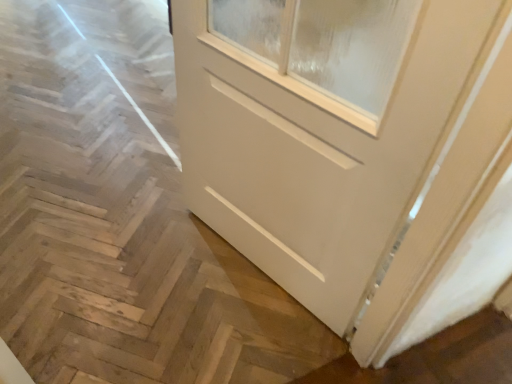
Find the location of a particular element. The width and height of the screenshot is (512, 384). free space in front of white matte door at center is located at coordinates (234, 336).